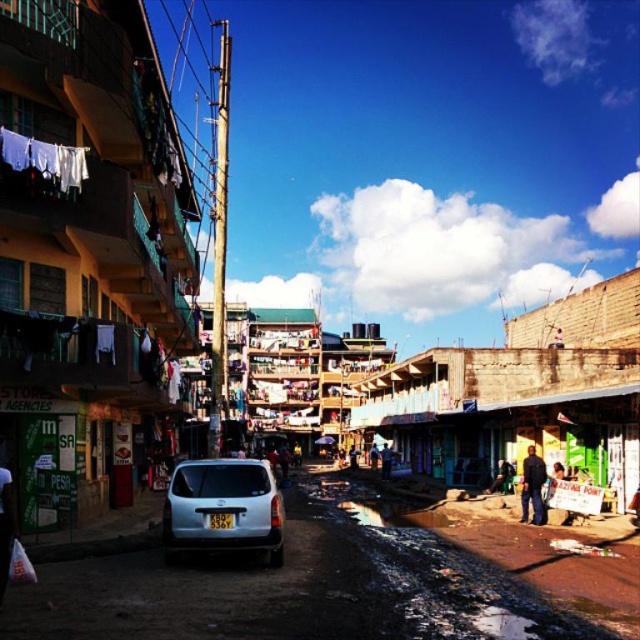
Consider the image. You are a delivery person trying to park your 1.8 meters wide van in this street. You see the satin silver suv at center and the white fabric at lower left. Which object has enough space next to it to accommodate your van?

The satin silver suv at center has a width larger than the white fabric at lower left, so the space next to the satin silver suv at center is wider and can accommodate your van.

You are standing on the street and want to take a photo of the satin silver suv at center. Considering the distance, will you need a zoom lens to capture the entire vehicle in the frame?

The satin silver suv at center is 185.08 feet from viewer, so you will need a zoom lens to capture the entire vehicle in the frame.